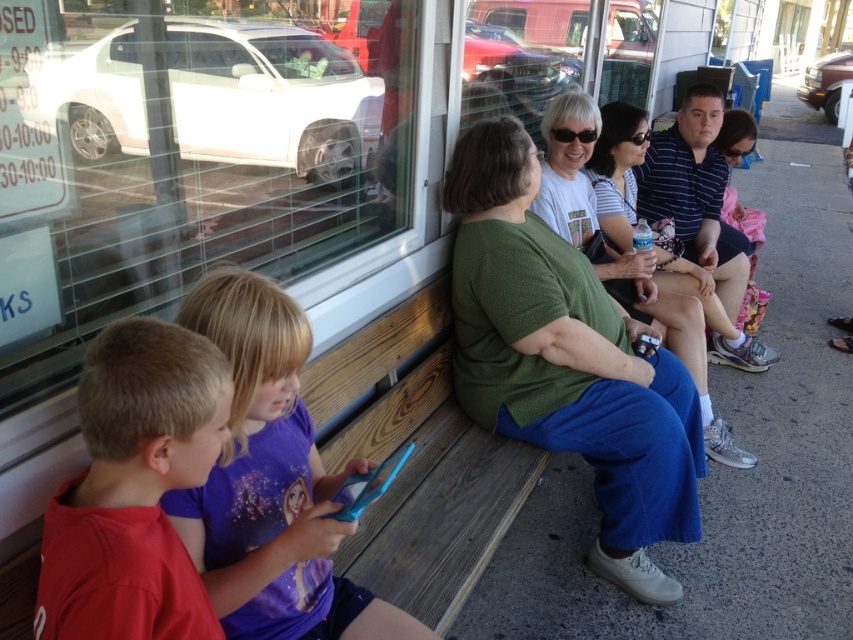
Which of these two, transparent glass window at lower left or red cotton shirt at lower left, stands taller?

With more height is transparent glass window at lower left.

Measure the distance between transparent glass window at lower left and camera.

transparent glass window at lower left is 35.62 inches away from camera.

Between point (96, 152) and point (142, 353), which one is positioned in front?

Point (142, 353) is in front.

Where is `transparent glass window at lower left`? Image resolution: width=853 pixels, height=640 pixels. transparent glass window at lower left is located at coordinates (190, 168).

Who is positioned more to the right, purple fabric shirt at lower left or red cotton shirt at lower left?

From the viewer's perspective, purple fabric shirt at lower left appears more on the right side.

You are a GUI agent. You are given a task and a screenshot of the screen. Output one action in this format:
    pyautogui.click(x=<x>, y=<y>)
    Task: Click on the purple fabric shirt at lower left
    The width and height of the screenshot is (853, 640).
    Given the screenshot: What is the action you would take?
    pyautogui.click(x=271, y=483)

Identify the location of purple fabric shirt at lower left. Image resolution: width=853 pixels, height=640 pixels. [271, 483].

Does green textured shirt at center have a lesser height compared to purple fabric shirt at lower left?

No.

Does green textured shirt at center have a greater height compared to purple fabric shirt at lower left?

Yes, green textured shirt at center is taller than purple fabric shirt at lower left.

Locate an element on the screen. This screenshot has width=853, height=640. green textured shirt at center is located at coordinates pyautogui.click(x=567, y=362).